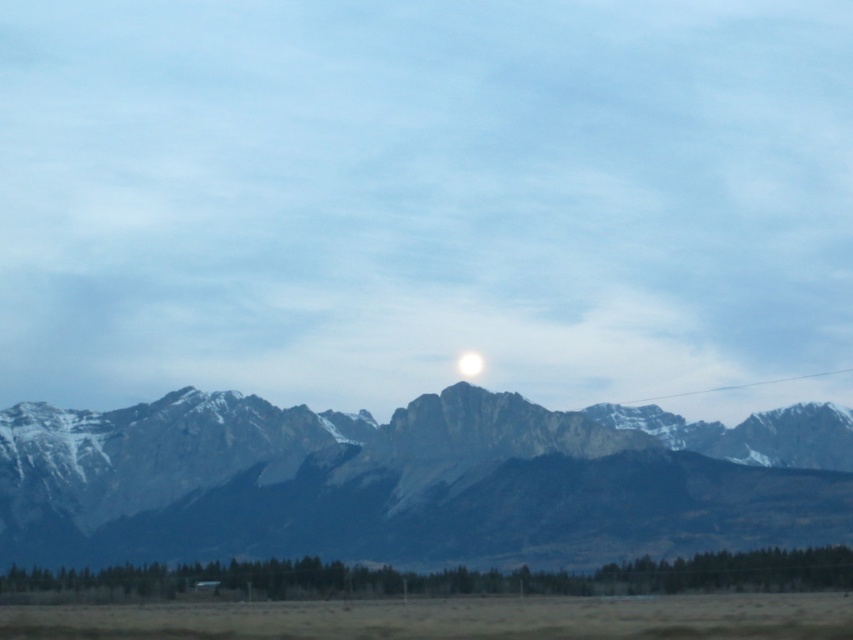
You are an environmental scientist analyzing the landscape. You need to determine which area is wider between the brown grassland at lower center and the clear plastic wire at upper right. Based on the scene, which one has a greater width?

The brown grassland at lower center has a greater width than the clear plastic wire at upper right.

You are an astronaut on the moon who wants to take a photo of the gray rocky mountain range at center and the white glossy moon at center. Which object should you focus on first if you want to capture both in a single frame?

The gray rocky mountain range at center has a larger size compared to the white glossy moon at center, so you should focus on the gray rocky mountain range at center first to ensure it is in sharp focus before adjusting for the smaller white glossy moon at center.

You are an artist setting up your easel to paint the landscape. You want to capture the gray rocky mountain range at center and the clear plastic wire at upper right in your painting. Based on their positions, which object should you paint first to ensure proper layering?

The gray rocky mountain range at center should be painted first because it is positioned on the left side of the clear plastic wire at upper right, meaning it is farther back and needs to be layered underneath.